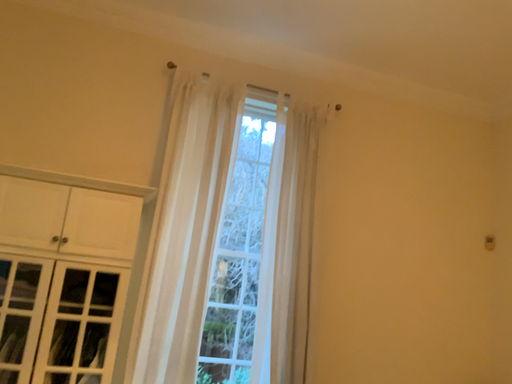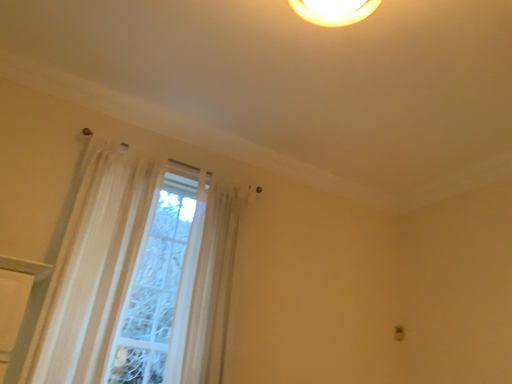
Question: How did the camera likely rotate when shooting the video?

Choices:
 (A) rotated upward
 (B) rotated downward

Answer: (A)